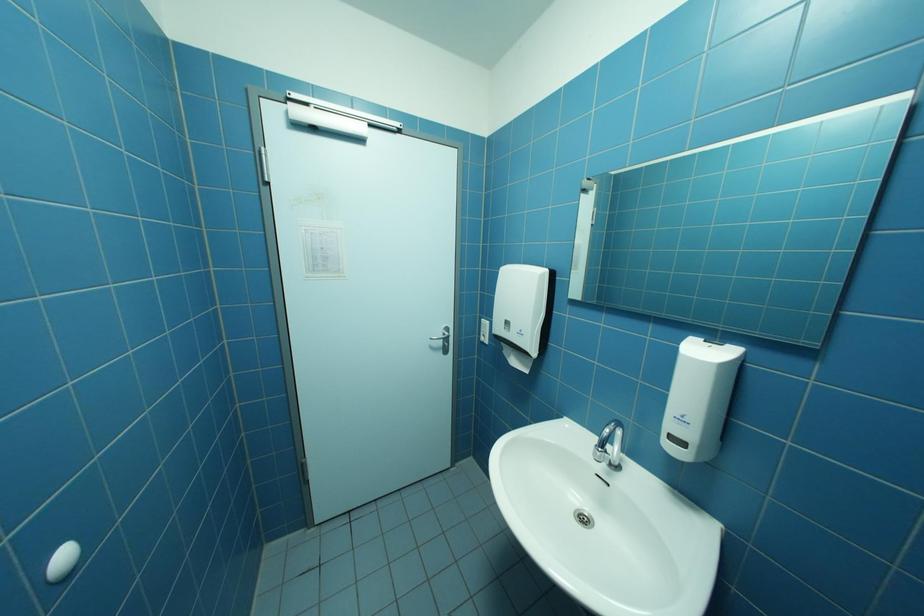
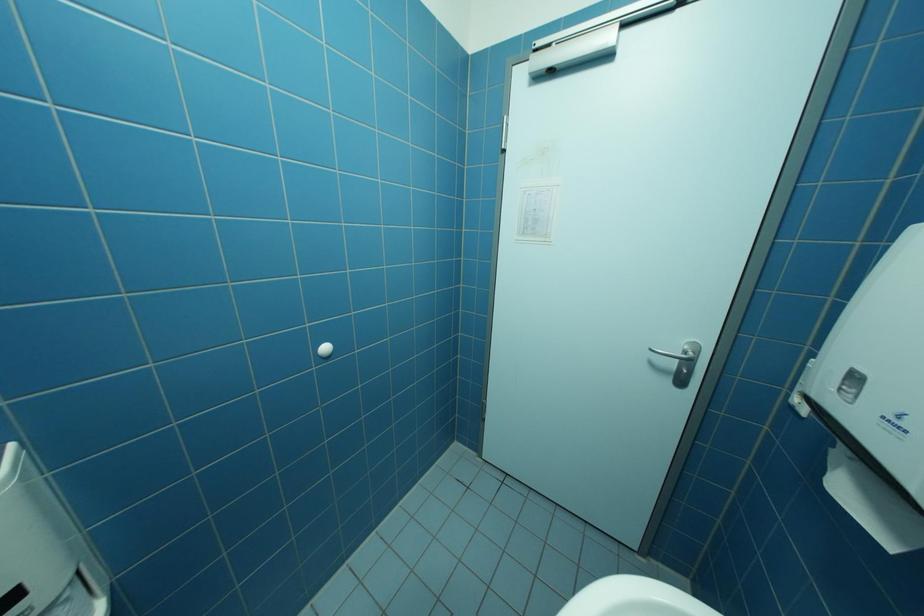
Question: The camera is either moving clockwise (left) or counter-clockwise (right) around the object. The first image is from the beginning of the video and the second image is from the end. Is the camera moving left or right when shooting the video?

Choices:
 (A) Left
 (B) Right

Answer: (B)